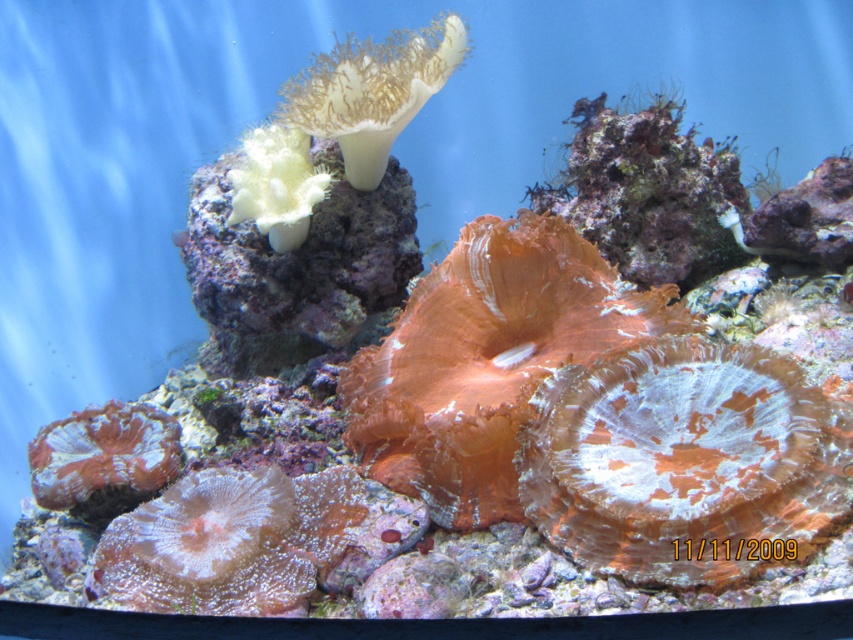
You are an underwater photographer aiming to capture both the orange coral at center and the orange coral at lower left in a single frame. Based on their positions, which coral is positioned to the left of the other?

The orange coral at lower left is positioned to the left of the orange coral at center.